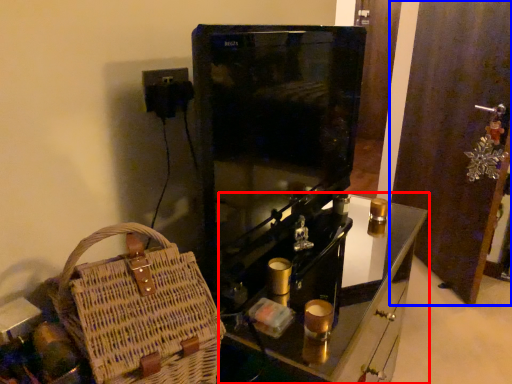
Question: Which point is further to the camera, furniture (highlighted by a red box) or door (highlighted by a blue box)?

Choices:
 (A) furniture
 (B) door

Answer: (B)